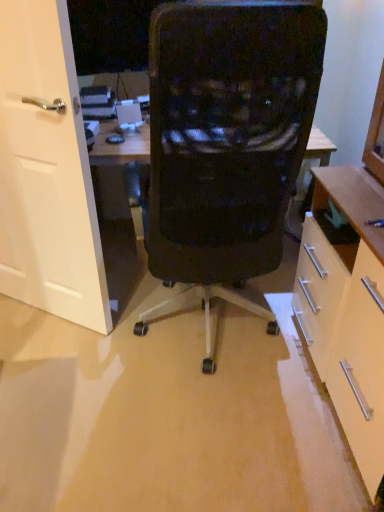
I want to click on free space in front of black mesh chair at center, so click(x=193, y=441).